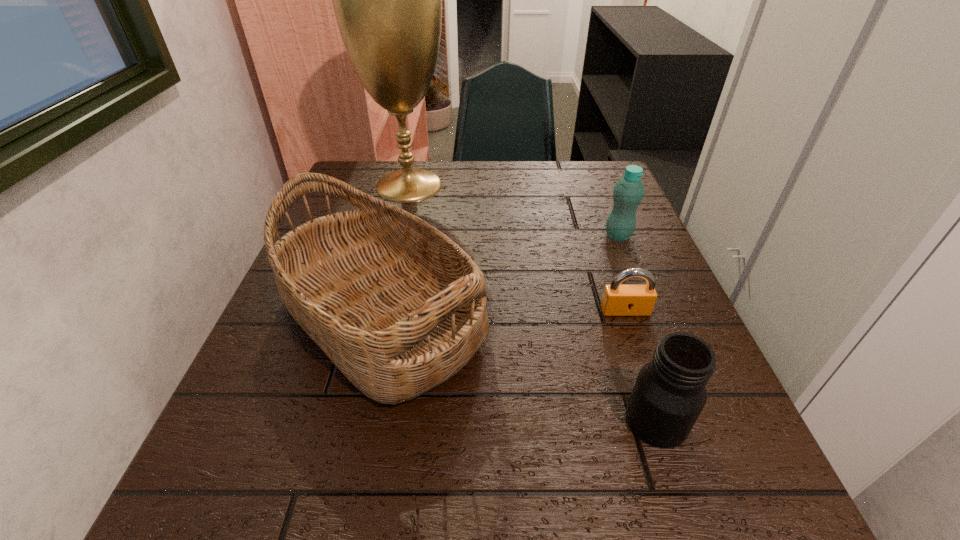
The image size is (960, 540). I want to click on vacant area at the left edge of the desktop, so click(303, 434).

Find the location of `vacant space at the right edge of the desktop`. vacant space at the right edge of the desktop is located at coordinates (605, 234).

I want to click on vacant area at the far left corner, so 367,181.

What are the coordinates of `vacant space that's between the second tallest object and the water bottle` in the screenshot? It's located at click(500, 277).

At what (x,y) coordinates should I click in order to perform the action: click on vacant space in between the basket and the fourth nearest object. Please return your answer as a coordinate pair (x, y). Looking at the image, I should click on (500, 277).

Image resolution: width=960 pixels, height=540 pixels. Find the location of `free space between the padlock and the fourth shortest object`. free space between the padlock and the fourth shortest object is located at coordinates (503, 315).

This screenshot has width=960, height=540. I want to click on free area in between the second tallest object and the water bottle, so click(500, 277).

The image size is (960, 540). Identify the location of unoccupied area between the farthest object and the water bottle. (514, 211).

Find the location of a particular element. The height and width of the screenshot is (540, 960). empty space between the jar and the fourth shortest object is located at coordinates (518, 369).

This screenshot has width=960, height=540. I want to click on vacant space that's between the shortest object and the second tallest object, so click(503, 315).